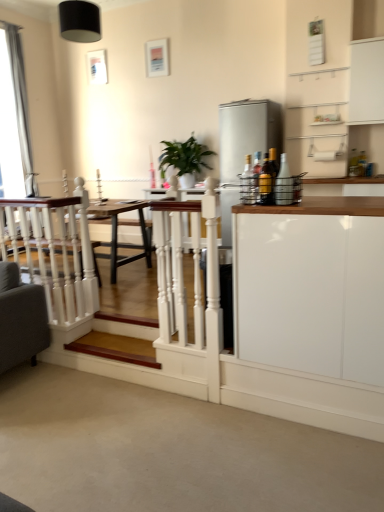
How much space does white glossy cabinet at right, placed as the 1th cabinetry when sorted from left to right, occupy horizontally?

25.51 inches.

Identify the location of translucent glass bottle at upper right, which ranks as the first bottle in left-to-right order. (248, 184).

Measure the distance between point (256, 141) and camera.

Point (256, 141) is 4.41 meters away from camera.

Locate an element on the screen. The height and width of the screenshot is (512, 384). green glossy plant at center is located at coordinates (185, 159).

The height and width of the screenshot is (512, 384). I want to click on silver metallic curtain at left, so click(x=14, y=118).

This screenshot has width=384, height=512. Describe the element at coordinates (266, 183) in the screenshot. I see `metallic gold bottle at right, arranged as the 2th bottle when viewed from the left` at that location.

You are a GUI agent. You are given a task and a screenshot of the screen. Output one action in this format:
    pyautogui.click(x=<x>, y=<y>)
    Task: Click on the white glossy cabinet at right, the 1th cabinetry positioned from the bottom
    Image resolution: width=384 pixels, height=512 pixels.
    Given the screenshot: What is the action you would take?
    pyautogui.click(x=311, y=286)

Consider the image. Would you say green glossy plant at center is to the left or to the right of satin silver refrigerator at right in the picture?

Based on their positions, green glossy plant at center is located to the left of satin silver refrigerator at right.

Based on the photo, are green glossy plant at center and satin silver refrigerator at right beside each other?

They are not placed beside each other.

Is green glossy plant at center in front of or behind satin silver refrigerator at right in the image?

Clearly, green glossy plant at center is behind satin silver refrigerator at right.

Looking at this image, is green glossy plant at center oriented towards satin silver refrigerator at right?

No, green glossy plant at center is not oriented towards satin silver refrigerator at right.

Is wooden step at lower left next to white glossy cabinet at right, marked as the 2th cabinetry in a top-to-bottom arrangement, and touching it?

No, wooden step at lower left is not beside white glossy cabinet at right, marked as the 2th cabinetry in a top-to-bottom arrangement.

Who is smaller, wooden step at lower left or white glossy cabinet at right, the first cabinetry viewed from the front?

wooden step at lower left.

From a real-world perspective, who is located lower, wooden step at lower left or white glossy cabinet at right, arranged as the 2th cabinetry when viewed from the right?

wooden step at lower left.

Between wooden step at lower left and white glossy cabinet at right, arranged as the 2th cabinetry when viewed from the right, which one is positioned behind?

Positioned behind is wooden step at lower left.

Which is more to the left, satin silver refrigerator at right or green glossy plant at center?

From the viewer's perspective, green glossy plant at center appears more on the left side.

At what (x,y) coordinates should I click in order to perform the action: click on houseplant on the left of satin silver refrigerator at right. Please return your answer as a coordinate pair (x, y). Looking at the image, I should click on (185, 159).

Would you say satin silver refrigerator at right is outside green glossy plant at center?

satin silver refrigerator at right lies outside green glossy plant at center's area.

Considering the positions of objects satin silver refrigerator at right and green glossy plant at center in the image provided, who is behind, satin silver refrigerator at right or green glossy plant at center?

green glossy plant at center.

Which point is more forward, (377, 84) or (0, 128)?

Point (377, 84)

This screenshot has height=512, width=384. I want to click on curtain above the white glossy cabinet at upper right, which appears as the 2th cabinetry when ordered from the bottom (from the image's perspective), so click(x=14, y=118).

How distant is white glossy cabinet at upper right, acting as the 1th cabinetry starting from the right, from silver metallic curtain at left?

white glossy cabinet at upper right, acting as the 1th cabinetry starting from the right, and silver metallic curtain at left are 3.83 meters apart.

From the image's perspective, would you say white glossy cabinet at upper right, which is the 2th cabinetry from front to back, is shown under silver metallic curtain at left?

Yes.

Visually, is satin silver refrigerator at right positioned to the left or to the right of wooden step at lower left?

satin silver refrigerator at right is positioned on wooden step at lower left's right side.

Looking at this image, between satin silver refrigerator at right and wooden step at lower left, which one has larger width?

Wider between the two is satin silver refrigerator at right.

Is satin silver refrigerator at right positioned before wooden step at lower left?

That is False.

Considering the relative sizes of green glossy plant at center and white glossy cabinet at upper right, which is the 2th cabinetry from front to back, in the image provided, is green glossy plant at center smaller than white glossy cabinet at upper right, which is the 2th cabinetry from front to back,?

Actually, green glossy plant at center might be larger than white glossy cabinet at upper right, which is the 2th cabinetry from front to back.

Considering the sizes of objects green glossy plant at center and white glossy cabinet at upper right, which appears as the 2th cabinetry when ordered from the bottom, in the image provided, who is shorter, green glossy plant at center or white glossy cabinet at upper right, which appears as the 2th cabinetry when ordered from the bottom,?

green glossy plant at center.

Is green glossy plant at center positioned beyond the bounds of white glossy cabinet at upper right, the first cabinetry from the top?

Yes.

Image resolution: width=384 pixels, height=512 pixels. Identify the location of cabinetry that appears above the satin silver refrigerator at right (from a real-world perspective). tap(366, 82).

Could you tell me if satin silver refrigerator at right is facing white glossy cabinet at upper right, which is the 2th cabinetry from left to right?

No, satin silver refrigerator at right is not aimed at white glossy cabinet at upper right, which is the 2th cabinetry from left to right.

In terms of size, does satin silver refrigerator at right appear bigger or smaller than white glossy cabinet at upper right, which is the 2th cabinetry from front to back?

Clearly, satin silver refrigerator at right is larger in size than white glossy cabinet at upper right, which is the 2th cabinetry from front to back.

Considering the positions of objects satin silver refrigerator at right and white glossy cabinet at upper right, which is the 2th cabinetry from left to right, in the image provided, who is more to the left, satin silver refrigerator at right or white glossy cabinet at upper right, which is the 2th cabinetry from left to right,?

From the viewer's perspective, satin silver refrigerator at right appears more on the left side.

The height and width of the screenshot is (512, 384). I want to click on appliance on the right side of green glossy plant at center, so click(247, 133).

I want to click on cabinetry in front of the wooden step at lower left, so click(311, 286).

Estimate the real-world distances between objects in this image. Which object is closer to metallic gold bottle at right, arranged as the 2th bottle when viewed from the left, satin silver refrigerator at right or translucent glass bottle at upper right, which ranks as the first bottle in left-to-right order?

translucent glass bottle at upper right, which ranks as the first bottle in left-to-right order, is closer to metallic gold bottle at right, arranged as the 2th bottle when viewed from the left.

Based on their spatial positions, is satin silver refrigerator at right or translucent glass bottle at upper right, which ranks as the first bottle in left-to-right order, closer to silver metallic curtain at left?

satin silver refrigerator at right is positioned closer to the anchor silver metallic curtain at left.

Considering their positions, is translucent glass bottle at right, the first bottle when ordered from right to left, positioned further to wooden step at lower left than satin silver refrigerator at right?

satin silver refrigerator at right is positioned further to the anchor wooden step at lower left.

Looking at the image, which one is located further to silver metallic curtain at left, white glossy cabinet at right, placed as the 1th cabinetry when sorted from left to right, or satin silver refrigerator at right?

white glossy cabinet at right, placed as the 1th cabinetry when sorted from left to right, lies further to silver metallic curtain at left than the other object.

From the picture: When comparing their distances from translucent glass bottle at right, the first bottle when ordered from right to left, does white glossy cabinet at right, the first cabinetry viewed from the front, or silver metallic curtain at left seem further?

silver metallic curtain at left is further to translucent glass bottle at right, the first bottle when ordered from right to left.

From the image, which object appears to be farther from silver metallic curtain at left, translucent glass bottle at right, acting as the third bottle starting from the left, or white glossy cabinet at upper right, positioned as the first cabinetry in back-to-front order?

white glossy cabinet at upper right, positioned as the first cabinetry in back-to-front order, is positioned further to the anchor silver metallic curtain at left.

When comparing their distances from translucent glass bottle at upper right, which ranks as the first bottle in left-to-right order, does wooden step at lower left or green glossy plant at center seem closer?

The object closer to translucent glass bottle at upper right, which ranks as the first bottle in left-to-right order, is green glossy plant at center.

Considering their positions, is translucent glass bottle at upper right, the 3th bottle viewed from the right, positioned closer to white glossy cabinet at right, marked as the 2th cabinetry in a top-to-bottom arrangement, than translucent glass bottle at right, the first bottle when ordered from right to left?

Based on the image, translucent glass bottle at right, the first bottle when ordered from right to left, appears to be nearer to white glossy cabinet at right, marked as the 2th cabinetry in a top-to-bottom arrangement.

Locate an element on the screen. The width and height of the screenshot is (384, 512). stairwell located between white glossy cabinet at right, marked as the 2th cabinetry in a top-to-bottom arrangement, and silver metallic curtain at left in the depth direction is located at coordinates [117, 347].

Identify the location of stairwell between translucent glass bottle at upper right, the 3th bottle viewed from the right, and silver metallic curtain at left in the front-back direction. (117, 347).

I want to click on stairwell situated between silver metallic curtain at left and satin silver refrigerator at right from left to right, so click(x=117, y=347).

Image resolution: width=384 pixels, height=512 pixels. What are the coordinates of `appliance between translucent glass bottle at right, the first bottle when ordered from right to left, and green glossy plant at center in the front-back direction` in the screenshot? It's located at (247, 133).